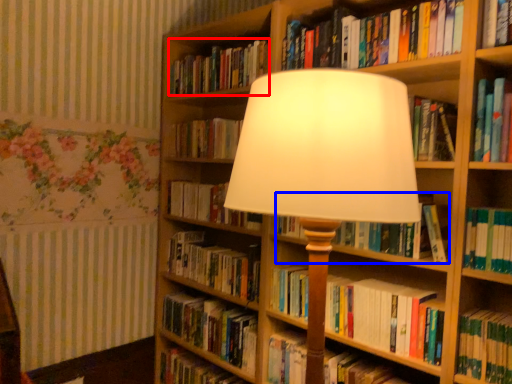
Question: Which object appears closest to the camera in this image, book (highlighted by a red box) or book (highlighted by a blue box)?

Choices:
 (A) book
 (B) book

Answer: (B)